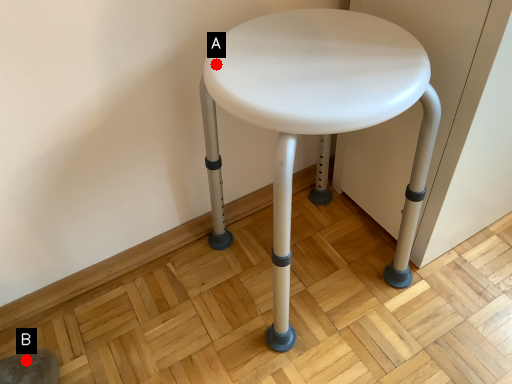
Question: Two points are circled on the image, labeled by A and B beside each circle. Among these points, which one is farthest from the camera?

Choices:
 (A) A is further
 (B) B is further

Answer: (B)